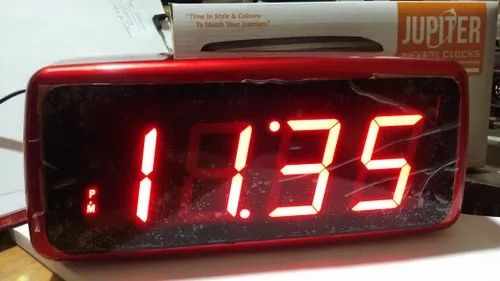
Locate an element on the screen. This screenshot has height=281, width=500. red shiny plastic casing of digital clock is located at coordinates (x=76, y=74).